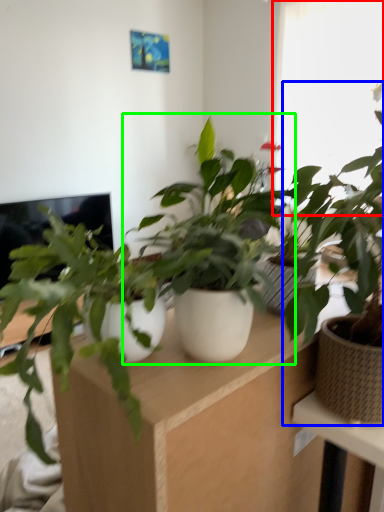
Question: Which is nearer to the window (highlighted by a red box)? houseplant (highlighted by a blue box) or houseplant (highlighted by a green box).

Choices:
 (A) houseplant
 (B) houseplant

Answer: (B)